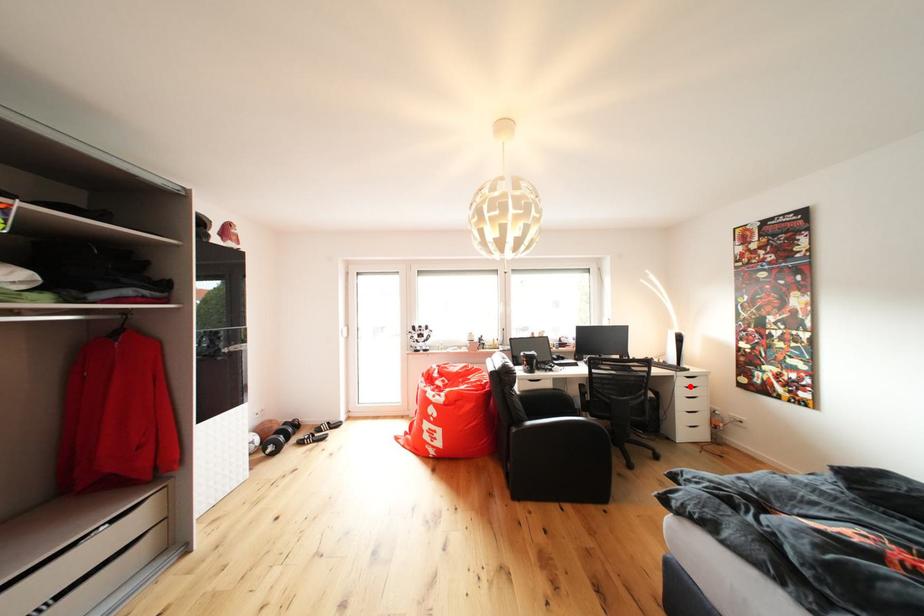
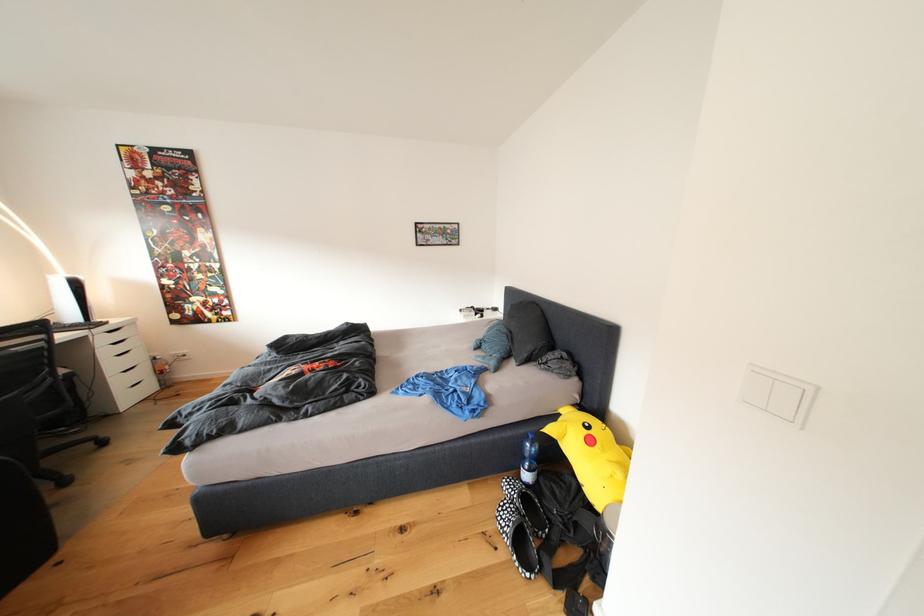
The point at the highlighted location is marked in the first image. Where is the corresponding point in the second image?

(111, 344)